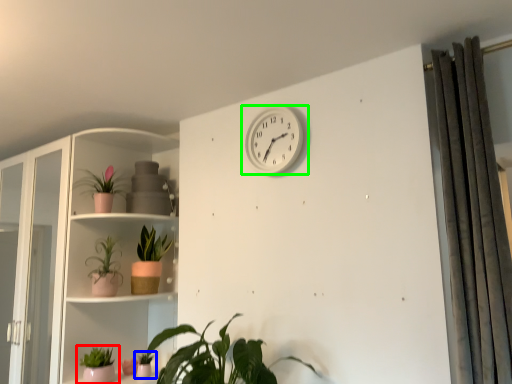
Question: Considering the real-world distances, which object is farthest from houseplant (highlighted by a red box)? houseplant (highlighted by a blue box) or wall clock (highlighted by a green box)?

Choices:
 (A) houseplant
 (B) wall clock

Answer: (B)